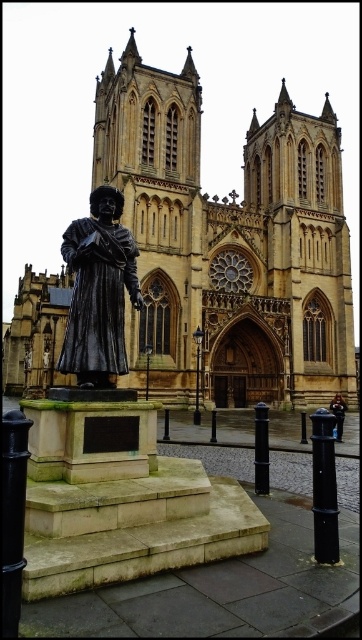
Question: Does beige stone church at center appear over polished bronze statue at center?

Choices:
 (A) yes
 (B) no

Answer: (A)

Question: Which point is farther to the camera?

Choices:
 (A) (103, 307)
 (B) (279, 314)

Answer: (B)

Question: Can you confirm if beige stone church at center is bigger than polished bronze statue at center?

Choices:
 (A) no
 (B) yes

Answer: (B)

Question: Which of the following is the farthest from the observer?

Choices:
 (A) polished bronze statue at center
 (B) beige stone church at center

Answer: (B)

Question: Observing the image, what is the correct spatial positioning of beige stone church at center in reference to polished bronze statue at center?

Choices:
 (A) above
 (B) below

Answer: (A)